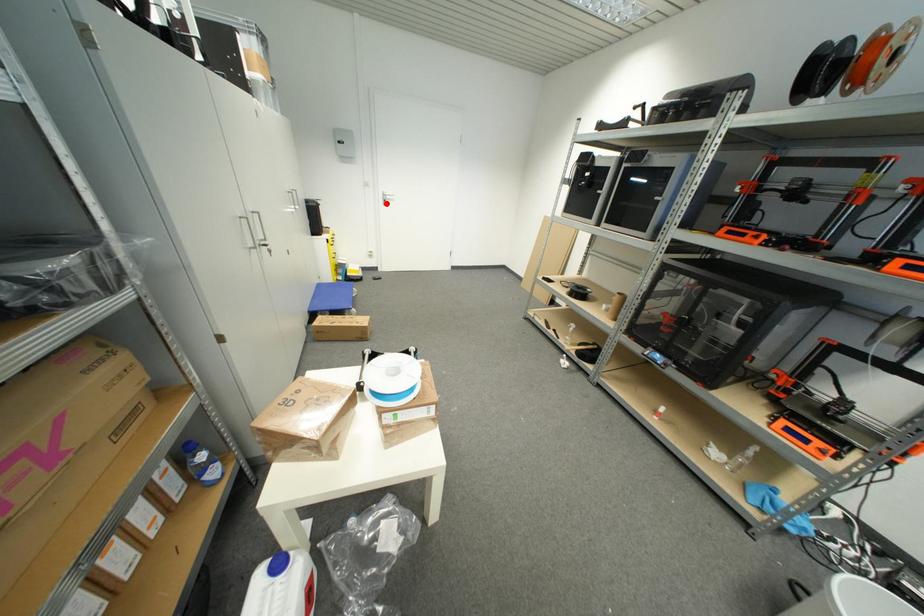
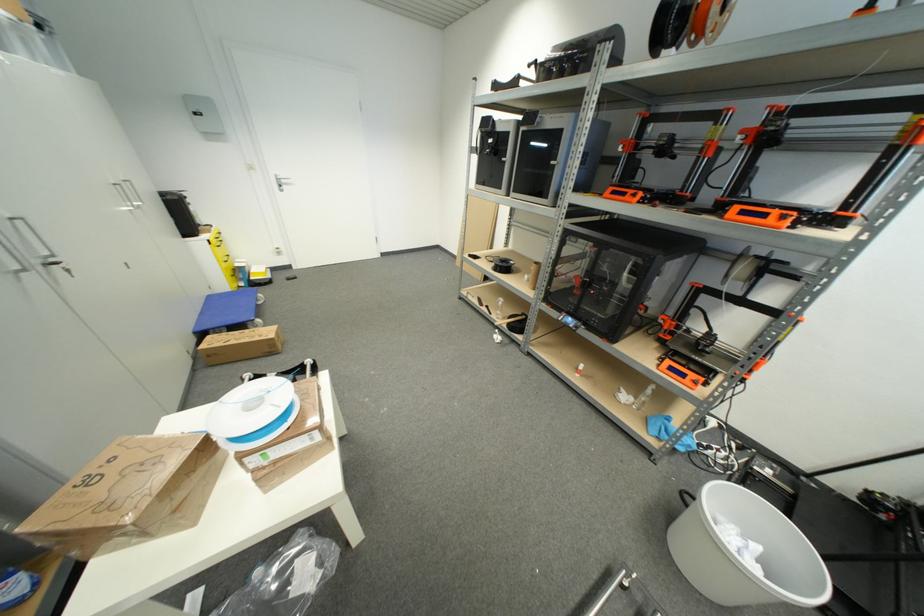
Locate, in the second image, the point that corresponds to the highlighted location in the first image.

(281, 188)